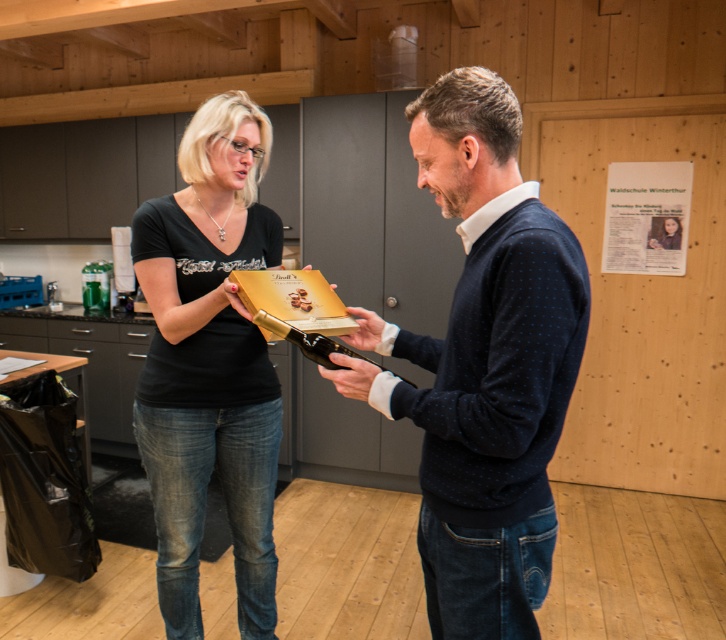
Is matte gold box at center shorter than matte black shirt at center?

Yes, matte gold box at center is shorter than matte black shirt at center.

Which is in front, point (501, 460) or point (203, 445)?

Positioned in front is point (501, 460).

This screenshot has height=640, width=726. What are the coordinates of `matte gold box at center` in the screenshot? It's located at (484, 365).